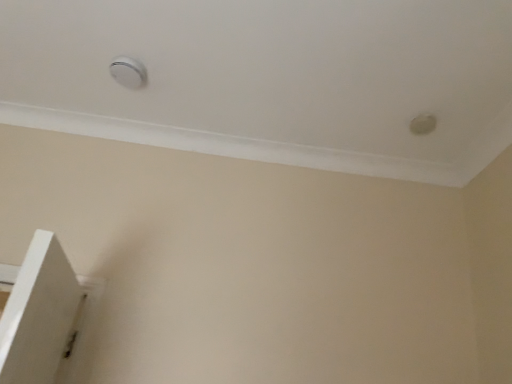
Question: Is the position of white plastic knob at upper center, which is counted as the second knob, starting from the bottom, more distant than that of white plastic knob at upper right, arranged as the first knob when ordered from the bottom?

Choices:
 (A) no
 (B) yes

Answer: (A)

Question: Is white plastic knob at upper center, the 1th knob viewed from the top, oriented towards white plastic knob at upper right, arranged as the first knob when ordered from the bottom?

Choices:
 (A) yes
 (B) no

Answer: (A)

Question: Does white plastic knob at upper center, the 1th knob viewed from the top, appear on the left side of white plastic knob at upper right, which is the second knob from left to right?

Choices:
 (A) yes
 (B) no

Answer: (A)

Question: From the image's perspective, does white plastic knob at upper center, the 2th knob positioned from the right, appear higher than white plastic knob at upper right, arranged as the first knob when ordered from the bottom?

Choices:
 (A) no
 (B) yes

Answer: (B)

Question: Does white plastic knob at upper center, the 2th knob positioned from the right, lie in front of white plastic knob at upper right, which is the 2th knob from top to bottom?

Choices:
 (A) yes
 (B) no

Answer: (A)

Question: From the image's perspective, is white plastic knob at upper center, the 1th knob viewed from the top, located beneath white plastic knob at upper right, which is the 2th knob from top to bottom?

Choices:
 (A) no
 (B) yes

Answer: (A)

Question: Is white plastic knob at upper right, which is the second knob from left to right, directly adjacent to white plastic knob at upper center, which is counted as the second knob, starting from the bottom?

Choices:
 (A) yes
 (B) no

Answer: (B)

Question: From the image's perspective, is white plastic knob at upper right, which is the second knob from left to right, below white plastic knob at upper center, the 2th knob positioned from the right?

Choices:
 (A) no
 (B) yes

Answer: (B)

Question: Does white plastic knob at upper right, arranged as the first knob when ordered from the bottom, have a greater width compared to white plastic knob at upper center, the 1th knob from the left?

Choices:
 (A) no
 (B) yes

Answer: (A)

Question: Considering the relative sizes of white plastic knob at upper right, arranged as the first knob when ordered from the bottom, and white plastic knob at upper center, the 1th knob viewed from the top, in the image provided, is white plastic knob at upper right, arranged as the first knob when ordered from the bottom, taller than white plastic knob at upper center, the 1th knob viewed from the top,?

Choices:
 (A) no
 (B) yes

Answer: (A)

Question: Is white plastic knob at upper right, which is the second knob from left to right, shorter than white plastic knob at upper center, the 1th knob viewed from the top?

Choices:
 (A) yes
 (B) no

Answer: (A)

Question: Is there a large distance between white plastic knob at upper right, arranged as the first knob when ordered from the bottom, and white plastic knob at upper center, the 2th knob positioned from the right?

Choices:
 (A) yes
 (B) no

Answer: (A)

Question: In terms of width, does white plastic knob at upper center, the 1th knob viewed from the top, look wider or thinner when compared to white plastic knob at upper right, which is the 2th knob from top to bottom?

Choices:
 (A) wide
 (B) thin

Answer: (A)